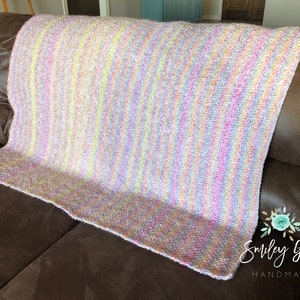
I want to click on brown door in background, so click(244, 11).